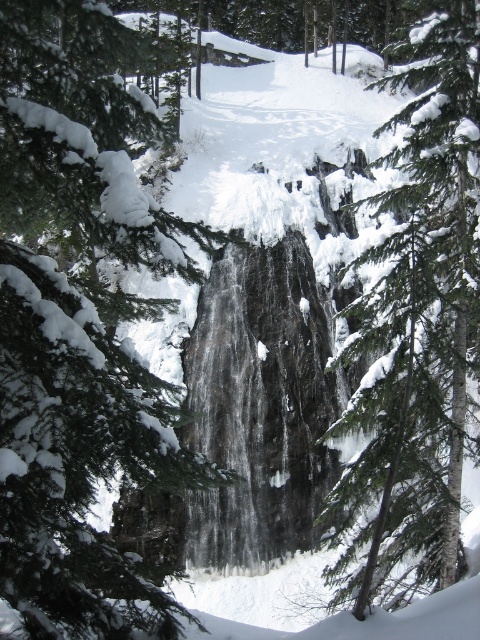
You are standing at the center of the winter landscape and want to locate the green textured pine tree at center. According to the coordinates provided, in which direction should you look to find it?

The green textured pine tree at center is located at coordinates point (80, 323), so you should look upward from the center position to find it.

In the scene shown: You are an environmental scientist assessing the health of trees in a winter landscape. You observe two green textured pine tree at center and green textured tree at center. Which tree has a narrower trunk?

The green textured pine tree at center is thinner than the green textured tree at center, so the green textured pine tree at center has a narrower trunk.

You are a hiker standing at the base of the waterfall and see the green textured pine tree at center and the green textured tree at center. Which tree is closer to you?

The green textured pine tree at center is closer to you because it is located below the green textured tree at center, meaning it is positioned lower in the scene.